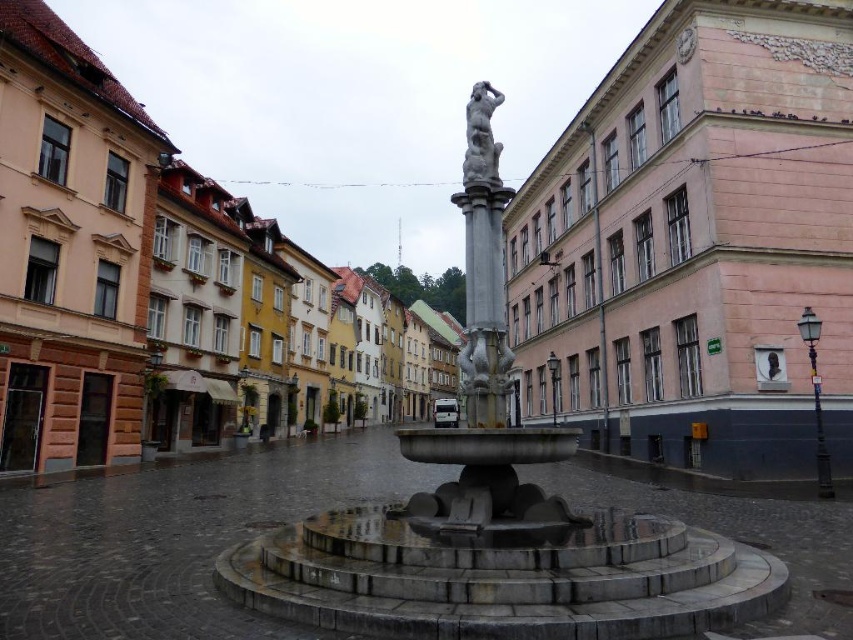
Question: Among these objects, which one is farthest from the camera?

Choices:
 (A) slate gray statue at center
 (B) polished stone column at center
 (C) matte black bust at center

Answer: (C)

Question: Where is slate gray statue at center located in relation to matte black bust at center in the image?

Choices:
 (A) above
 (B) below

Answer: (A)

Question: Among these objects, which one is farthest from the camera?

Choices:
 (A) polished stone column at center
 (B) matte black bust at center

Answer: (B)

Question: Which of the following is the farthest from the observer?

Choices:
 (A) (479, 300)
 (B) (769, 378)

Answer: (B)

Question: Does polished stone column at center appear under slate gray statue at center?

Choices:
 (A) no
 (B) yes

Answer: (B)

Question: Where is polished stone column at center located in relation to slate gray statue at center in the image?

Choices:
 (A) right
 (B) left

Answer: (A)